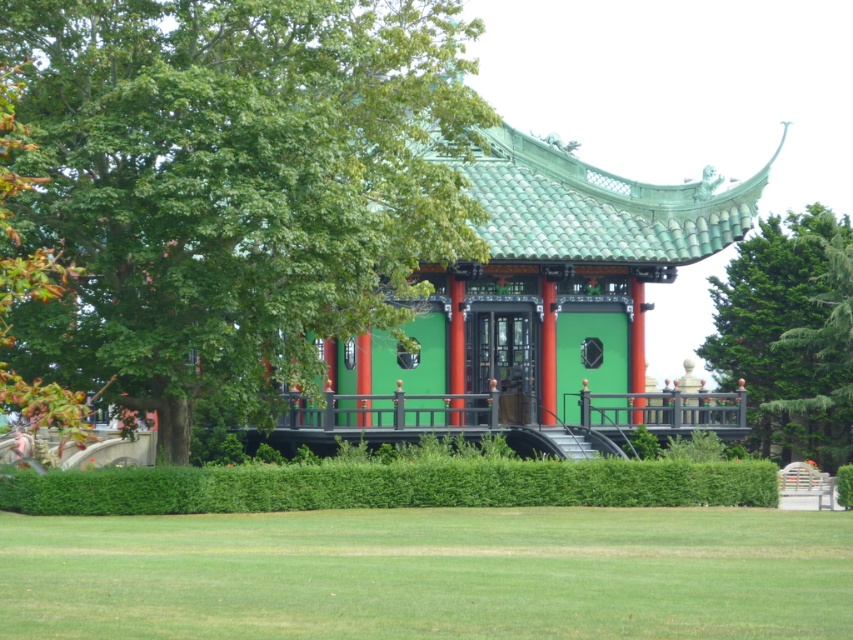
Does green grass at lower center appear under green matte pavilion at center?

Yes, green grass at lower center is below green matte pavilion at center.

Can you confirm if green grass at lower center is thinner than green matte pavilion at center?

In fact, green grass at lower center might be wider than green matte pavilion at center.

Is point (450, 540) behind point (541, 371)?

No, it is in front of (541, 371).

Identify the location of green grass at lower center. (430, 573).

Between green leafy hedge at lower center and green textured tree at upper right, which one has less height?

Standing shorter between the two is green leafy hedge at lower center.

Between green leafy hedge at lower center and green textured tree at upper right, which one is positioned lower?

green leafy hedge at lower center is below.

This screenshot has width=853, height=640. Find the location of `green leafy hedge at lower center`. green leafy hedge at lower center is located at coordinates (387, 484).

Is green grass at lower center taller than green leafy hedge at lower center?

In fact, green grass at lower center may be shorter than green leafy hedge at lower center.

Where is `green grass at lower center`? The width and height of the screenshot is (853, 640). green grass at lower center is located at coordinates (430, 573).

Between point (811, 576) and point (149, 500), which one is positioned in front?

Point (811, 576) is in front.

This screenshot has height=640, width=853. Find the location of `green grass at lower center`. green grass at lower center is located at coordinates (430, 573).